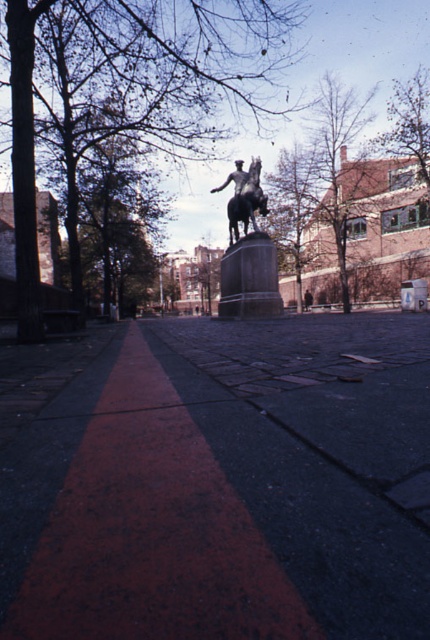
Question: Does bronze statue at center have a smaller size compared to polished bronze statue at center?

Choices:
 (A) no
 (B) yes

Answer: (B)

Question: From the image, what is the correct spatial relationship of bronze statue at center in relation to polished bronze statue at center?

Choices:
 (A) left
 (B) right

Answer: (B)

Question: Which object appears farthest from the camera in this image?

Choices:
 (A) polished bronze statue at center
 (B) bronze statue at center

Answer: (A)

Question: Is bronze statue at center to the left of polished bronze statue at center from the viewer's perspective?

Choices:
 (A) yes
 (B) no

Answer: (B)

Question: Which point is closer to the camera taking this photo?

Choices:
 (A) (221, 282)
 (B) (252, 202)

Answer: (B)